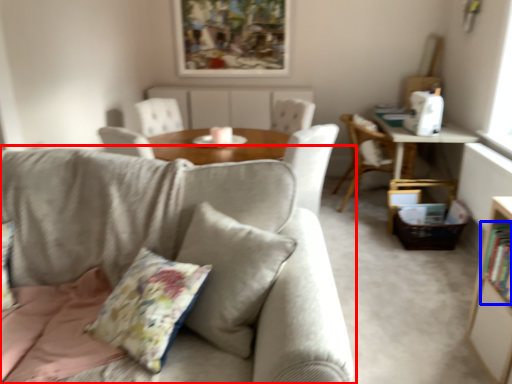
Question: Which object appears farthest to the camera in this image, studio couch (highlighted by a red box) or book (highlighted by a blue box)?

Choices:
 (A) studio couch
 (B) book

Answer: (B)